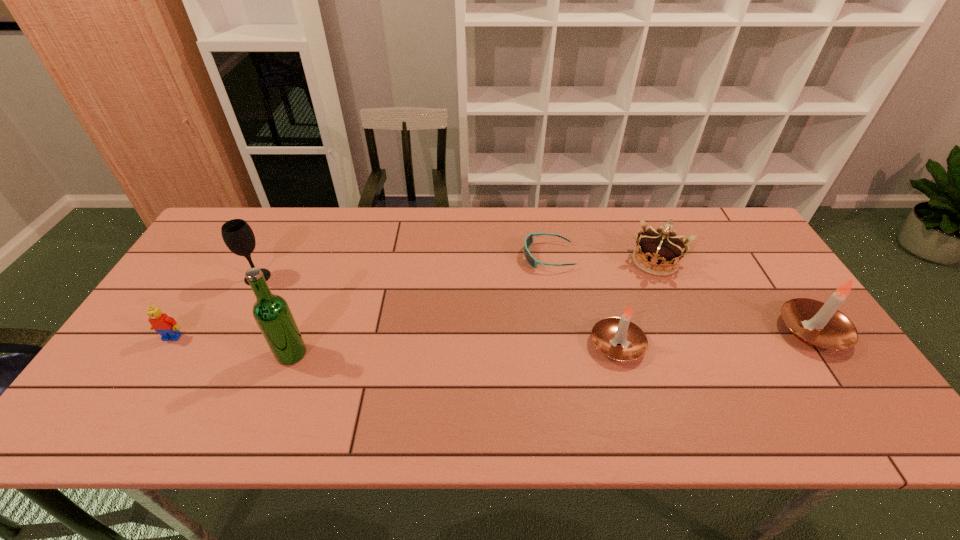
Where is `vacant position located 0.150m on the back of the left candle`? The image size is (960, 540). vacant position located 0.150m on the back of the left candle is located at coordinates (600, 284).

I want to click on vacant space located on the left of the rightmost object, so click(653, 331).

Find the location of a particular element. Image resolution: width=960 pixels, height=540 pixels. vacant region located on the front-facing side of the sunglasses is located at coordinates (451, 256).

Where is `free location located on the front-facing side of the sunglasses`? free location located on the front-facing side of the sunglasses is located at coordinates (468, 256).

Identify the location of vacant area located 0.260m on the front-facing side of the sunglasses. The width and height of the screenshot is (960, 540). (439, 256).

Image resolution: width=960 pixels, height=540 pixels. In order to click on free space located 0.380m on the right of the second object from left to right in this screenshot , I will do `click(399, 277)`.

Identify the location of free space located 0.070m on the face of the Lego. Image resolution: width=960 pixels, height=540 pixels. (156, 364).

Where is `vacant space positioned 0.090m on the back of the crown`? vacant space positioned 0.090m on the back of the crown is located at coordinates (640, 227).

In order to click on free point located 0.100m on the back of the third object from left to right in this screenshot , I will do `click(307, 312)`.

The image size is (960, 540). Find the location of `sunglasses located in the far edge section of the desktop`. sunglasses located in the far edge section of the desktop is located at coordinates (528, 242).